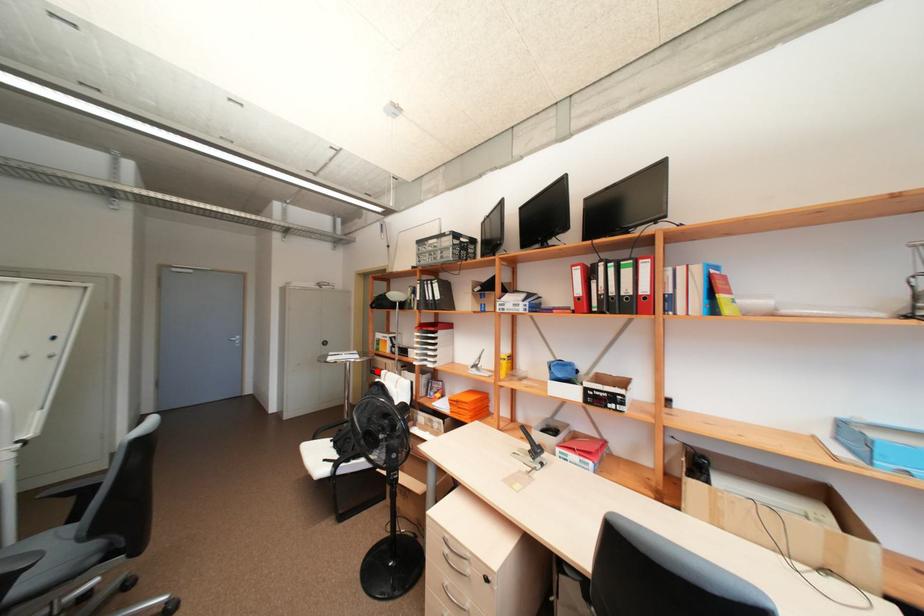
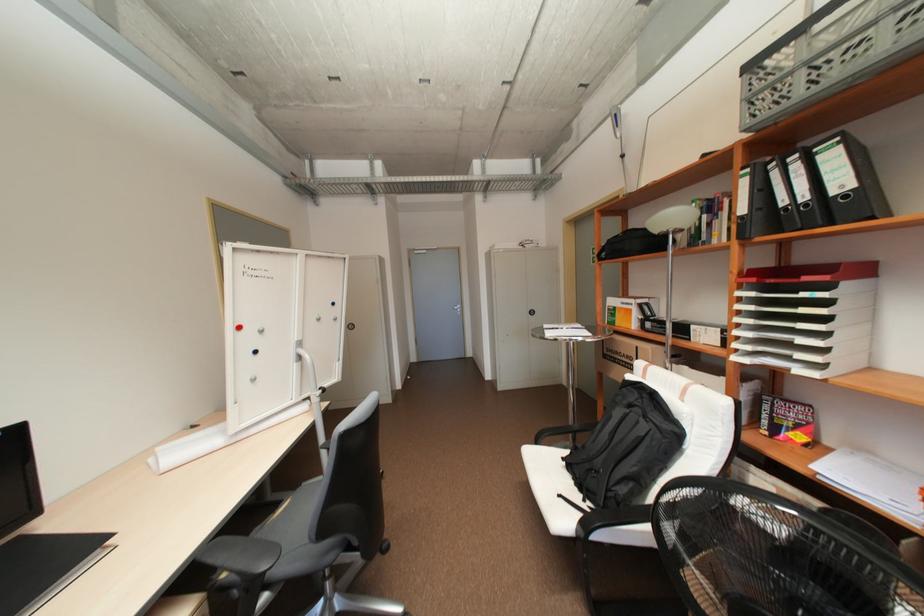
Find the pixel in the second image that matches the highlighted location in the first image.

(611, 355)